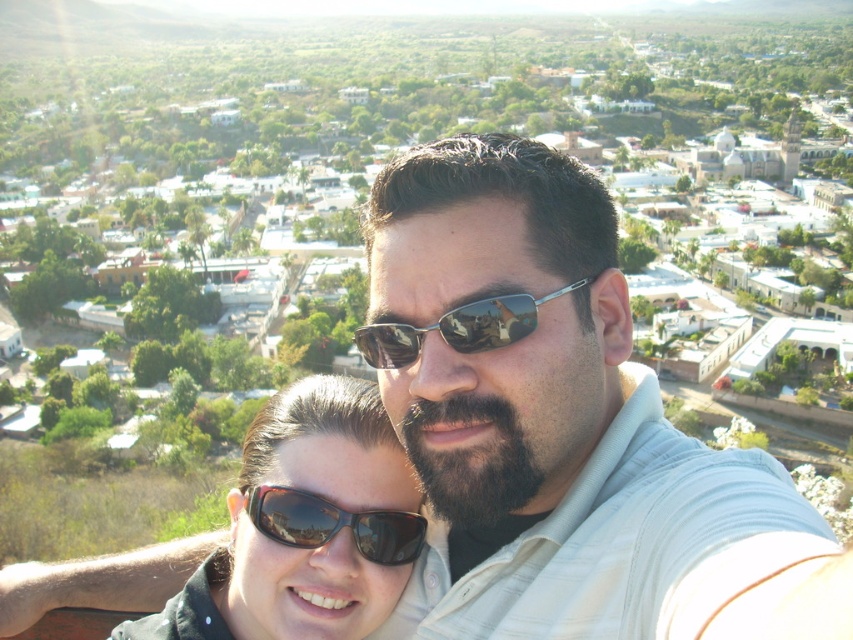
Does point (457, 403) come farther from viewer compared to point (347, 584)?

No, (457, 403) is in front of (347, 584).

Who is positioned more to the left, matte white shirt at center or black matte sunglasses at center?

black matte sunglasses at center

Between point (668, 524) and point (296, 632), which one is positioned behind?

Point (296, 632)

You are a GUI agent. You are given a task and a screenshot of the screen. Output one action in this format:
    pyautogui.click(x=<x>, y=<y>)
    Task: Click on the matte white shirt at center
    This screenshot has width=853, height=640.
    Given the screenshot: What is the action you would take?
    pyautogui.click(x=561, y=426)

Is point (165, 616) in front of point (370, 346)?

Yes.

Can you confirm if black matte sunglasses at center is positioned to the left of metallic reflective sunglasses at center?

Indeed, black matte sunglasses at center is positioned on the left side of metallic reflective sunglasses at center.

Between point (276, 493) and point (587, 280), which one is positioned in front?

Point (587, 280)

Find the location of a particular element. The height and width of the screenshot is (640, 853). black matte sunglasses at center is located at coordinates (305, 525).

Does matte white shirt at center have a greater height compared to black reflective sunglasses at center?

Yes, matte white shirt at center is taller than black reflective sunglasses at center.

In the scene shown: Does matte white shirt at center appear over black reflective sunglasses at center?

Indeed, matte white shirt at center is positioned over black reflective sunglasses at center.

Find the location of a particular element. The image size is (853, 640). matte white shirt at center is located at coordinates (561, 426).